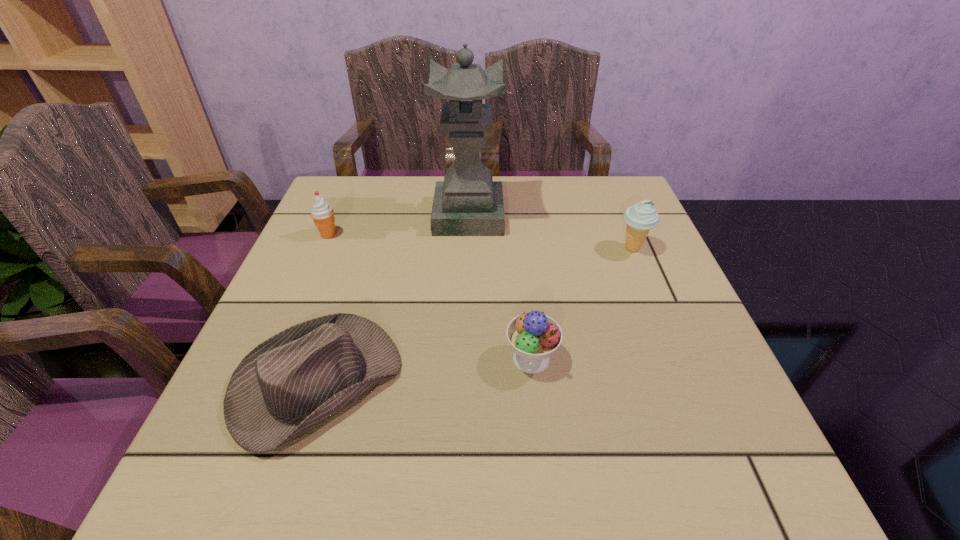
The image size is (960, 540). Find the location of `the tallest object`. the tallest object is located at coordinates (468, 202).

The width and height of the screenshot is (960, 540). I want to click on the rightmost object, so click(x=640, y=218).

This screenshot has width=960, height=540. Identify the location of the leftmost icecream. (322, 213).

This screenshot has height=540, width=960. What are the coordinates of `the nearest icecream` in the screenshot? It's located at (534, 336).

The width and height of the screenshot is (960, 540). In order to click on fedora in this screenshot , I will do `click(289, 384)`.

At what (x,y) coordinates should I click in order to perform the action: click on blank area located 0.180m at the front opening of the tallest object. Please return your answer as a coordinate pair (x, y). The width and height of the screenshot is (960, 540). Looking at the image, I should click on (571, 215).

Locate an element on the screen. Image resolution: width=960 pixels, height=540 pixels. free spot located 0.340m on the front of the rightmost object is located at coordinates (688, 382).

The height and width of the screenshot is (540, 960). What are the coordinates of `vacant space situated on the front of the leftmost icecream` in the screenshot? It's located at (297, 309).

At what (x,y) coordinates should I click in order to perform the action: click on free space located 0.220m on the right of the second icecream from left to right. Please return your answer as a coordinate pair (x, y). The image size is (960, 540). Looking at the image, I should click on (677, 359).

At what (x,y) coordinates should I click in order to perform the action: click on free region located 0.190m on the back of the fedora. Please return your answer as a coordinate pair (x, y). Looking at the image, I should click on (355, 262).